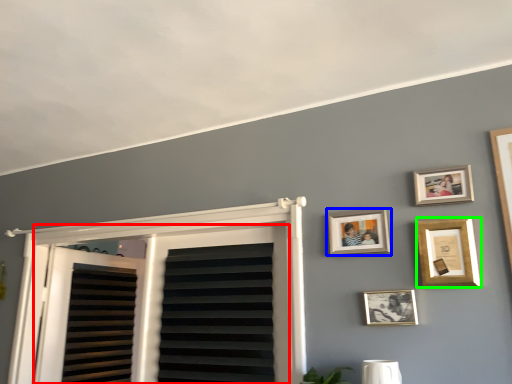
Question: Based on their relative distances, which object is nearer to window (highlighted by a red box)? Choose from picture frame (highlighted by a blue box) and picture frame (highlighted by a green box).

Choices:
 (A) picture frame
 (B) picture frame

Answer: (A)